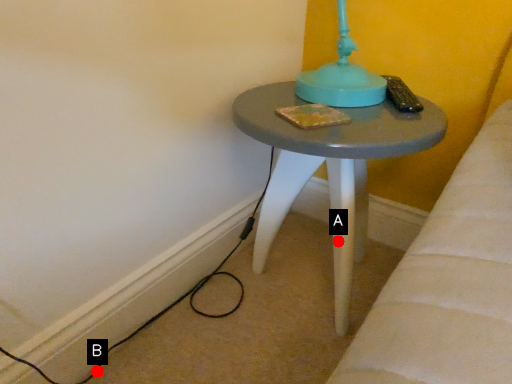
Question: Two points are circled on the image, labeled by A and B beside each circle. Which point is closer to the camera?

Choices:
 (A) A is closer
 (B) B is closer

Answer: (B)